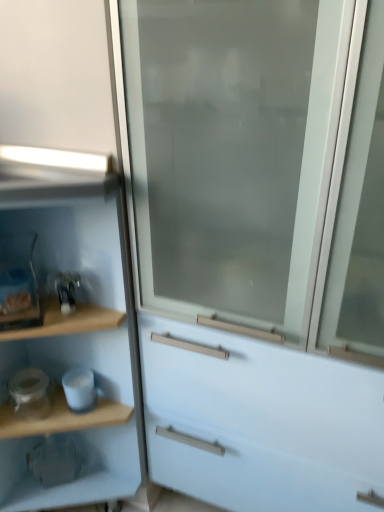
The height and width of the screenshot is (512, 384). Describe the element at coordinates (237, 157) in the screenshot. I see `frosted glass screen door at center` at that location.

Identify the location of white glossy jar at lower left, which is counted as the first appliance, starting from the left. This screenshot has height=512, width=384. (30, 394).

How much space does white glossy jar at lower left, which is counted as the first appliance, starting from the left, occupy vertically?

4.33 inches.

Find the location of a particular element. wooden shelf at left is located at coordinates (72, 334).

Locate an element on the screen. The height and width of the screenshot is (512, 384). white glossy mug at lower left, which is the first appliance in right-to-left order is located at coordinates (80, 389).

Based on the photo, is white glossy jar at lower left, which is counted as the first appliance, starting from the left, outside of wooden shelf at left?

No, most part of white glossy jar at lower left, which is counted as the first appliance, starting from the left, lies within wooden shelf at left.

Considering the relative sizes of white glossy jar at lower left, which is counted as the 2th appliance, starting from the right, and wooden shelf at left in the image provided, is white glossy jar at lower left, which is counted as the 2th appliance, starting from the right, bigger than wooden shelf at left?

No.

Between white glossy jar at lower left, which is counted as the first appliance, starting from the left, and wooden shelf at left, which one appears on the left side from the viewer's perspective?

Positioned to the left is wooden shelf at left.

The image size is (384, 512). I want to click on appliance that is the 2nd one when counting backward from the wooden shelf at left, so click(80, 389).

In the scene shown: Which object is wider, wooden shelf at left or white glossy mug at lower left, which is the first appliance in right-to-left order?

wooden shelf at left is wider.

Is wooden shelf at left aimed at white glossy mug at lower left, which appears as the second appliance when viewed from the left?

Yes.

Between wooden shelf at left and white glossy mug at lower left, which is the first appliance in right-to-left order, which one appears on the right side from the viewer's perspective?

white glossy mug at lower left, which is the first appliance in right-to-left order, is more to the right.

Does frosted glass screen door at center appear on the left side of white glossy mug at lower left, which is the first appliance in right-to-left order?

No, frosted glass screen door at center is not to the left of white glossy mug at lower left, which is the first appliance in right-to-left order.

The width and height of the screenshot is (384, 512). There is a white glossy mug at lower left, which appears as the second appliance when viewed from the left. In order to click on screen door above it (from a real-world perspective) in this screenshot , I will do (x=237, y=157).

Measure the distance between frosted glass screen door at center and white glossy mug at lower left, which is the first appliance in right-to-left order.

frosted glass screen door at center and white glossy mug at lower left, which is the first appliance in right-to-left order, are 25.10 inches apart.

Which of these two, frosted glass screen door at center or white glossy mug at lower left, which appears as the second appliance when viewed from the left, stands shorter?

Standing shorter between the two is white glossy mug at lower left, which appears as the second appliance when viewed from the left.

Where is `appliance above the white glossy jar at lower left, which is counted as the 2th appliance, starting from the right (from a real-world perspective)`? Image resolution: width=384 pixels, height=512 pixels. appliance above the white glossy jar at lower left, which is counted as the 2th appliance, starting from the right (from a real-world perspective) is located at coordinates (80, 389).

Is white glossy mug at lower left, which appears as the second appliance when viewed from the left, not close to white glossy jar at lower left, which is counted as the first appliance, starting from the left?

No, there isn't a large distance between white glossy mug at lower left, which appears as the second appliance when viewed from the left, and white glossy jar at lower left, which is counted as the first appliance, starting from the left.

How many degrees apart are the facing directions of white glossy mug at lower left, which is the first appliance in right-to-left order, and white glossy jar at lower left, which is counted as the 2th appliance, starting from the right?

The facing directions of white glossy mug at lower left, which is the first appliance in right-to-left order, and white glossy jar at lower left, which is counted as the 2th appliance, starting from the right, are 32.5 degrees apart.

How far apart are white glossy mug at lower left, which is the first appliance in right-to-left order, and white glossy jar at lower left, which is counted as the first appliance, starting from the left?

The distance of white glossy mug at lower left, which is the first appliance in right-to-left order, from white glossy jar at lower left, which is counted as the first appliance, starting from the left, is 9.58 centimeters.

Where is `screen door above the white glossy jar at lower left, which is counted as the 2th appliance, starting from the right (from the image's perspective)`? screen door above the white glossy jar at lower left, which is counted as the 2th appliance, starting from the right (from the image's perspective) is located at coordinates (237, 157).

Is point (225, 16) behind point (34, 417)?

No, (225, 16) is in front of (34, 417).

What's the angular difference between frosted glass screen door at center and white glossy jar at lower left, which is counted as the first appliance, starting from the left,'s facing directions?

37 degrees separate the facing orientations of frosted glass screen door at center and white glossy jar at lower left, which is counted as the first appliance, starting from the left.

Which object is positioned more to the left, frosted glass screen door at center or white glossy jar at lower left, which is counted as the 2th appliance, starting from the right?

white glossy jar at lower left, which is counted as the 2th appliance, starting from the right.

Is white glossy jar at lower left, which is counted as the 2th appliance, starting from the right, taller or shorter than frosted glass screen door at center?

In the image, white glossy jar at lower left, which is counted as the 2th appliance, starting from the right, appears to be shorter than frosted glass screen door at center.

Which object is positioned more to the right, white glossy jar at lower left, which is counted as the first appliance, starting from the left, or frosted glass screen door at center?

frosted glass screen door at center.

The width and height of the screenshot is (384, 512). There is a white glossy jar at lower left, which is counted as the 2th appliance, starting from the right. Identify the location of screen door above it (from a real-world perspective). (237, 157).

Is white glossy mug at lower left, which is the first appliance in right-to-left order, taller than wooden shelf at left?

In fact, white glossy mug at lower left, which is the first appliance in right-to-left order, may be shorter than wooden shelf at left.

Is white glossy mug at lower left, which is the first appliance in right-to-left order, touching wooden shelf at left?

No, white glossy mug at lower left, which is the first appliance in right-to-left order, is not in contact with wooden shelf at left.

Is white glossy mug at lower left, which is the first appliance in right-to-left order, to the left of wooden shelf at left from the viewer's perspective?

No, white glossy mug at lower left, which is the first appliance in right-to-left order, is not to the left of wooden shelf at left.

The height and width of the screenshot is (512, 384). Find the location of `cupboard lying on the left of white glossy jar at lower left, which is counted as the 2th appliance, starting from the right`. cupboard lying on the left of white glossy jar at lower left, which is counted as the 2th appliance, starting from the right is located at coordinates (72, 334).

You are a GUI agent. You are given a task and a screenshot of the screen. Output one action in this format:
    pyautogui.click(x=<x>, y=<y>)
    Task: Click on the cupboard that is in front of the white glossy mug at lower left, which is the first appliance in right-to-left order
    This screenshot has height=512, width=384.
    Given the screenshot: What is the action you would take?
    pyautogui.click(x=72, y=334)

In the scene shown: Considering their positions, is white glossy jar at lower left, which is counted as the first appliance, starting from the left, positioned closer to wooden shelf at left than white glossy mug at lower left, which is the first appliance in right-to-left order?

Among the two, white glossy mug at lower left, which is the first appliance in right-to-left order, is located nearer to wooden shelf at left.

Considering their positions, is white glossy mug at lower left, which is the first appliance in right-to-left order, positioned closer to white glossy jar at lower left, which is counted as the 2th appliance, starting from the right, than wooden shelf at left?

white glossy mug at lower left, which is the first appliance in right-to-left order, lies closer to white glossy jar at lower left, which is counted as the 2th appliance, starting from the right, than the other object.

Considering their positions, is white glossy mug at lower left, which appears as the second appliance when viewed from the left, positioned further to wooden shelf at left than white glossy jar at lower left, which is counted as the first appliance, starting from the left?

The object further to wooden shelf at left is white glossy jar at lower left, which is counted as the first appliance, starting from the left.

From the picture: Based on their spatial positions, is frosted glass screen door at center or white glossy mug at lower left, which appears as the second appliance when viewed from the left, further from white glossy jar at lower left, which is counted as the first appliance, starting from the left?

frosted glass screen door at center.

Which object lies nearer to the anchor point frosted glass screen door at center, wooden shelf at left or white glossy jar at lower left, which is counted as the 2th appliance, starting from the right?

wooden shelf at left is positioned closer to the anchor frosted glass screen door at center.

When comparing their distances from frosted glass screen door at center, does white glossy jar at lower left, which is counted as the first appliance, starting from the left, or wooden shelf at left seem closer?

wooden shelf at left is positioned closer to the anchor frosted glass screen door at center.

Which object lies nearer to the anchor point white glossy mug at lower left, which appears as the second appliance when viewed from the left, white glossy jar at lower left, which is counted as the 2th appliance, starting from the right, or frosted glass screen door at center?

The object closer to white glossy mug at lower left, which appears as the second appliance when viewed from the left, is white glossy jar at lower left, which is counted as the 2th appliance, starting from the right.

In the scene shown: When comparing their distances from white glossy jar at lower left, which is counted as the 2th appliance, starting from the right, does wooden shelf at left or white glossy mug at lower left, which appears as the second appliance when viewed from the left, seem closer?

white glossy mug at lower left, which appears as the second appliance when viewed from the left.

At what (x,y) coordinates should I click in order to perform the action: click on appliance between wooden shelf at left and white glossy mug at lower left, which appears as the second appliance when viewed from the left, in the front-back direction. Please return your answer as a coordinate pair (x, y). The image size is (384, 512). Looking at the image, I should click on (30, 394).

This screenshot has width=384, height=512. Identify the location of appliance situated between white glossy jar at lower left, which is counted as the 2th appliance, starting from the right, and frosted glass screen door at center from left to right. (80, 389).